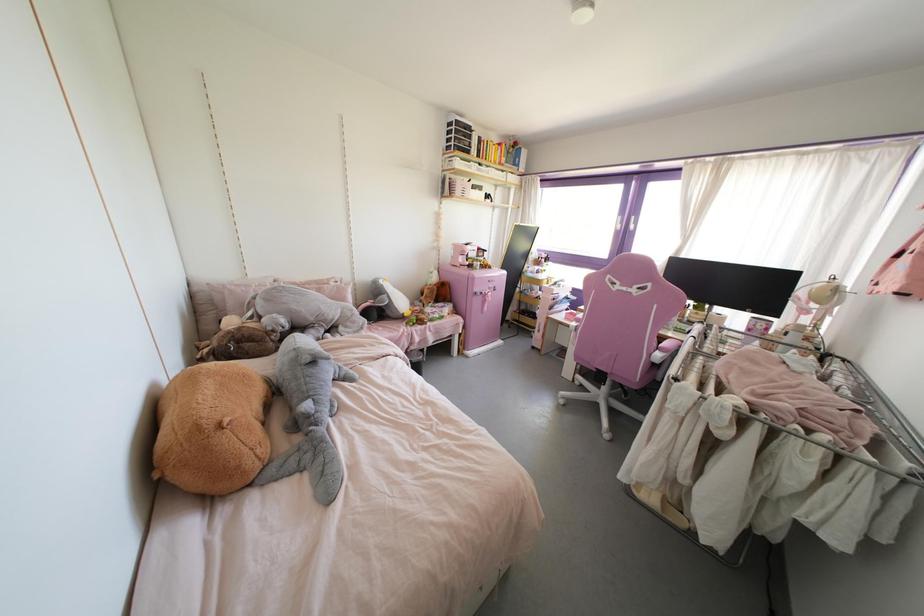
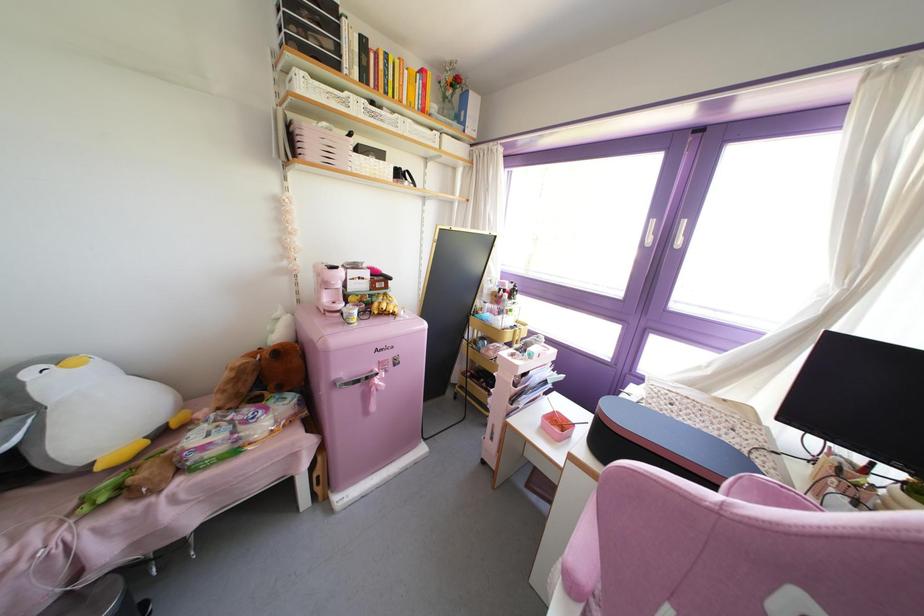
Locate, in the second image, the point that corresponds to point (405, 314) in the first image.

(99, 467)